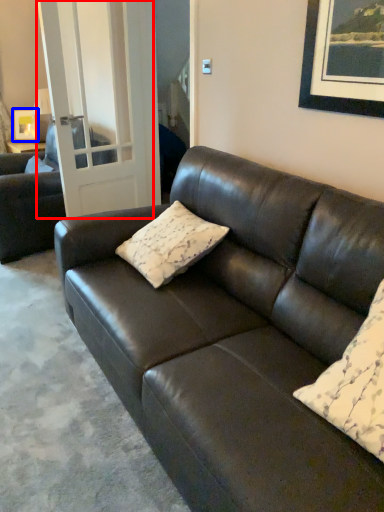
Question: Which object is further to the camera taking this photo, glass door (highlighted by a red box) or picture frame (highlighted by a blue box)?

Choices:
 (A) glass door
 (B) picture frame

Answer: (B)